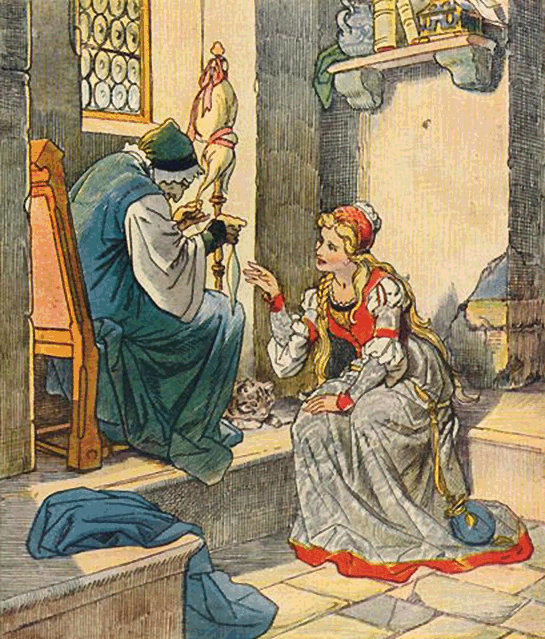
Locate an element on the screen. ledge is located at coordinates (263, 459).